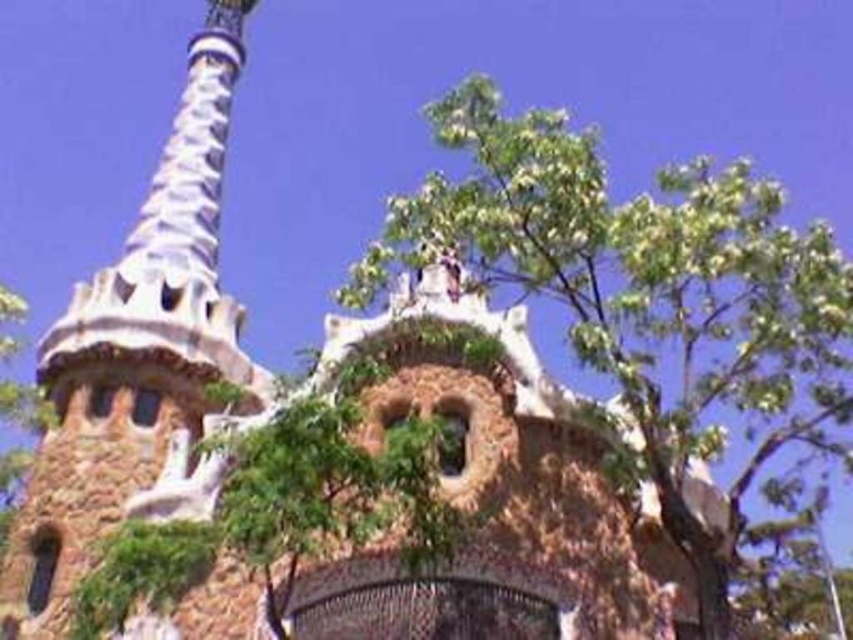
Question: Which point is closer to the camera?

Choices:
 (A) (498, 198)
 (B) (49, 330)

Answer: (A)

Question: In this image, where is green leafy tree at upper center located relative to brown stone tower at upper left?

Choices:
 (A) above
 (B) below

Answer: (A)

Question: Which of the following is the closest to the observer?

Choices:
 (A) brown stone tower at upper left
 (B) green leafy tree at upper center

Answer: (B)

Question: Is green leafy tree at upper center to the right of brown stone tower at upper left from the viewer's perspective?

Choices:
 (A) no
 (B) yes

Answer: (B)

Question: Does green leafy tree at upper center have a larger size compared to brown stone tower at upper left?

Choices:
 (A) yes
 (B) no

Answer: (A)